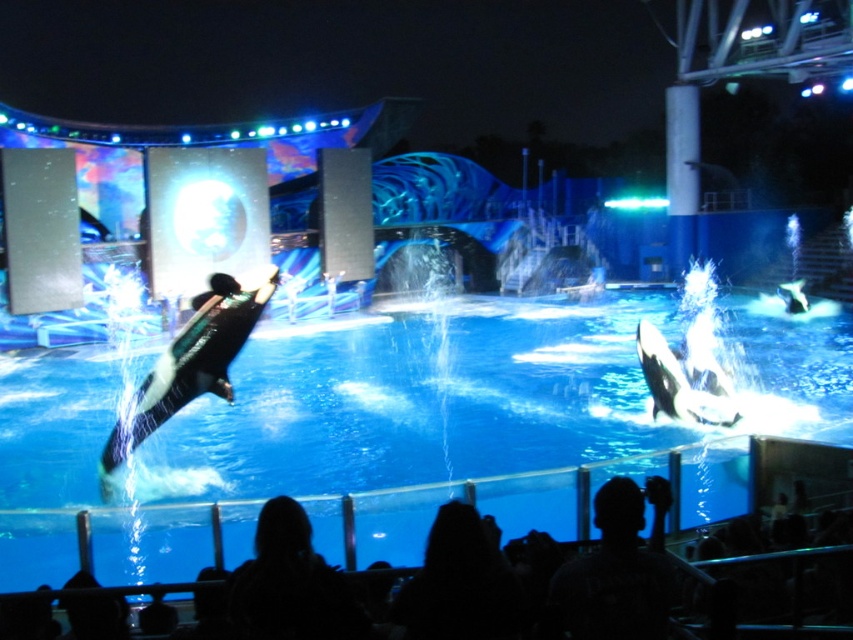
Question: From the image, what is the correct spatial relationship of black matte orca at center in relation to black smooth dolphin at center?

Choices:
 (A) left
 (B) right

Answer: (B)

Question: Which point is closer to the camera taking this photo?

Choices:
 (A) (577, 308)
 (B) (128, 428)
 (C) (698, 378)
 (D) (834, 502)

Answer: (D)

Question: Which of the following is the farthest from the observer?

Choices:
 (A) (90, 477)
 (B) (672, 371)

Answer: (B)

Question: Can you confirm if dark hair at lower center is positioned below black smooth dolphin at center?

Choices:
 (A) yes
 (B) no

Answer: (A)

Question: Where is black matte orca at center located in relation to black and white smooth orca at center in the image?

Choices:
 (A) below
 (B) above

Answer: (A)

Question: Which point appears closest to the camera in this image?

Choices:
 (A) (228, 289)
 (B) (194, 570)
 (C) (312, 577)
 (D) (645, 378)

Answer: (C)